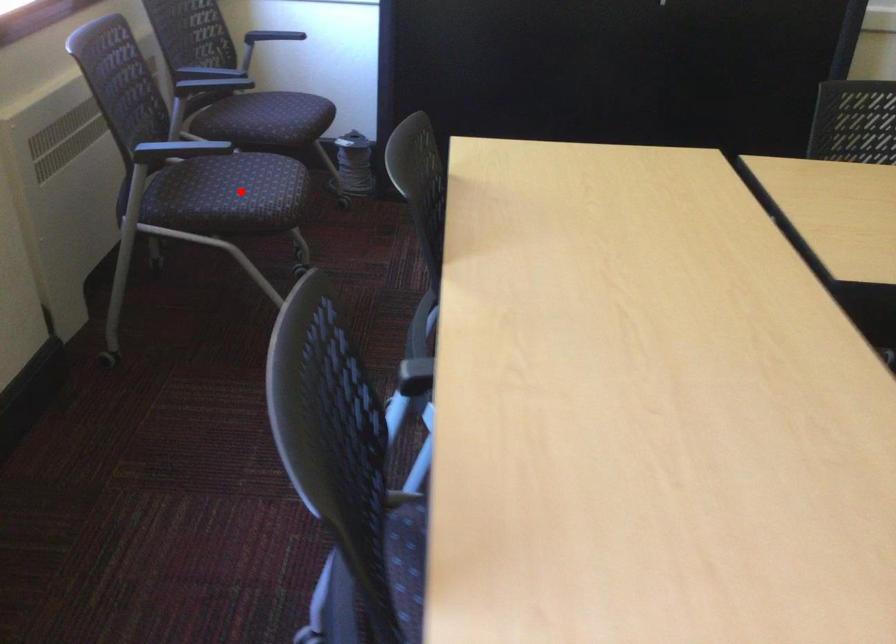
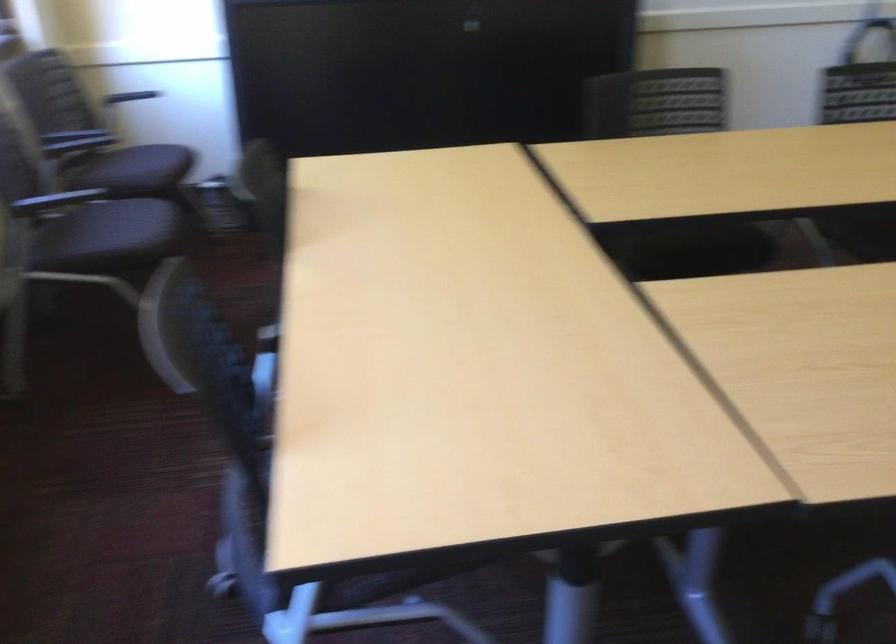
Locate, in the second image, the point that corresponds to the highlighted location in the first image.

(116, 234)